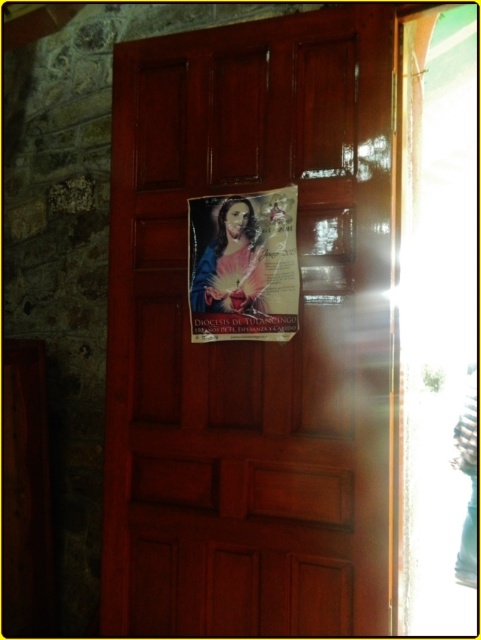
Question: Is wooden door at center smaller than matte paper poster at center?

Choices:
 (A) yes
 (B) no

Answer: (B)

Question: Which point is farther to the camera?

Choices:
 (A) tap(369, 422)
 (B) tap(282, 189)

Answer: (B)

Question: Which point is closer to the camera?

Choices:
 (A) (296, 61)
 (B) (239, 214)

Answer: (A)

Question: Does wooden door at center lie behind matte paper poster at center?

Choices:
 (A) yes
 (B) no

Answer: (B)

Question: Does wooden door at center have a greater width compared to matte paper poster at center?

Choices:
 (A) no
 (B) yes

Answer: (B)